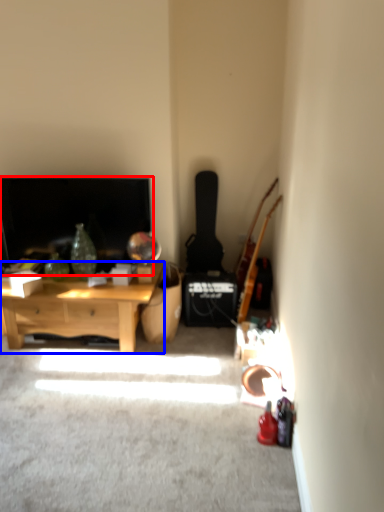
Question: Which object is further to the camera taking this photo, fireplace (highlighted by a red box) or desk (highlighted by a blue box)?

Choices:
 (A) fireplace
 (B) desk

Answer: (A)